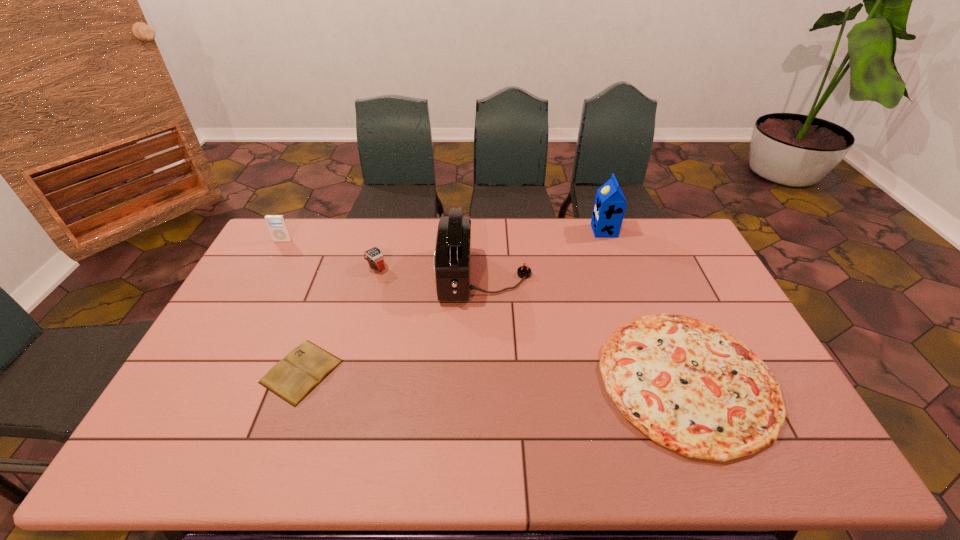
Image resolution: width=960 pixels, height=540 pixels. What are the coordinates of `object at the near edge` in the screenshot? It's located at (688, 385).

You are a GUI agent. You are given a task and a screenshot of the screen. Output one action in this format:
    pyautogui.click(x=<x>, y=<y>)
    Task: Click on the object that is at the left edge
    
    Given the screenshot: What is the action you would take?
    click(x=277, y=225)

At what (x,y) coordinates should I click in order to perform the action: click on object positioned at the right edge. Please return your answer as a coordinate pair (x, y). This screenshot has width=960, height=540. Looking at the image, I should click on (688, 385).

Identify the location of object located in the far left corner section of the desktop. Image resolution: width=960 pixels, height=540 pixels. (277, 225).

Where is `object that is at the near right corner`? The width and height of the screenshot is (960, 540). object that is at the near right corner is located at coordinates click(x=688, y=385).

The width and height of the screenshot is (960, 540). I want to click on vacant space at the far edge of the desktop, so click(x=369, y=247).

You are a GUI agent. You are given a task and a screenshot of the screen. Output one action in this format:
    pyautogui.click(x=<x>, y=<y>)
    Task: Click on the vacant space at the near edge of the desktop
    
    Given the screenshot: What is the action you would take?
    pyautogui.click(x=424, y=467)

Where is `vacant space at the left edge`? The height and width of the screenshot is (540, 960). vacant space at the left edge is located at coordinates (235, 321).

I want to click on blank space at the right edge of the desktop, so click(x=678, y=275).

Find the location of `free space at the far left corner of the desktop`. free space at the far left corner of the desktop is located at coordinates (295, 225).